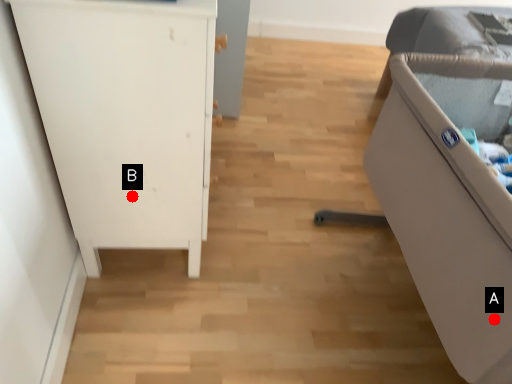
Question: Two points are circled on the image, labeled by A and B beside each circle. Which point is closer to the camera?

Choices:
 (A) A is closer
 (B) B is closer

Answer: (A)